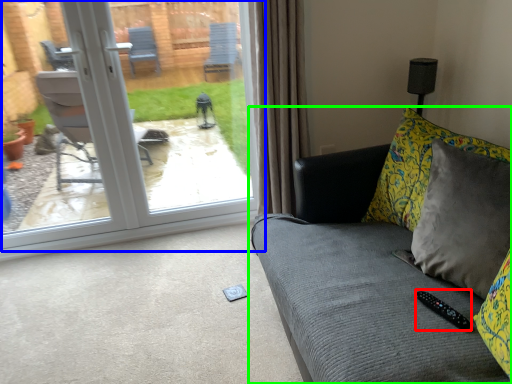
Question: Considering the real-world distances, which object is farthest from remote (highlighted by a red box)? door (highlighted by a blue box) or studio couch (highlighted by a green box)?

Choices:
 (A) door
 (B) studio couch

Answer: (A)